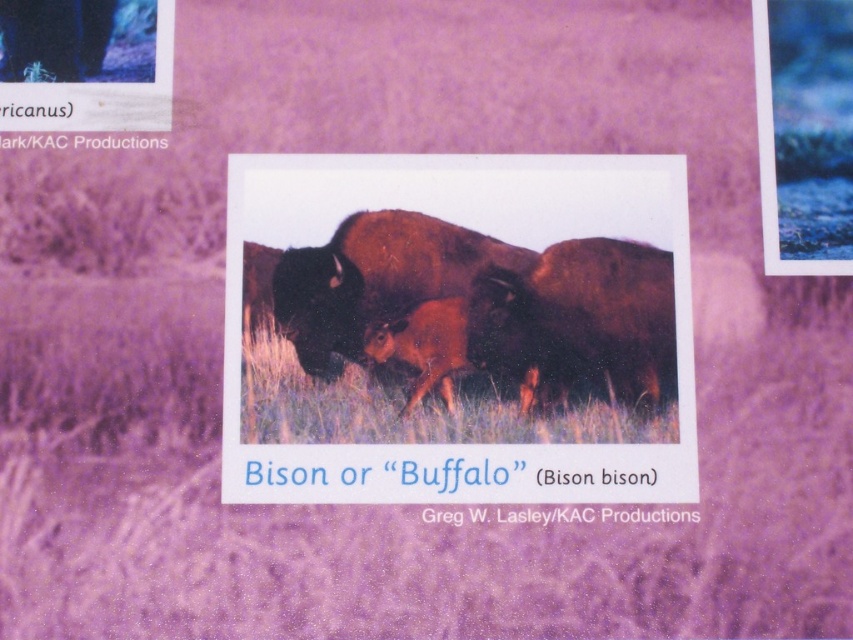
You are standing in front of a photograph of bison. There are two points marked on the photo, one at coordinates point (498,451) and another at point (349,273). If you were to draw a straight line from your current position to each point, which point would require the line to pass closer to the adult bison?

Point (498,451) is in front of point (349,273). Since the adult bison is likely positioned towards the front of the image, the line to point (498,451) would pass closer to the adult bison.

You are a museum curator planning to display a new exhibit about bison. The photograph in the scene is part of the exhibit. You need to ensure that the two bison in the photograph are clearly visible to visitors. Given that the minimum viewing distance for the exhibit is 10 feet, will the 2.84 inches distance between the brown fur bison at center and brown fuzzy bison at center be sufficient for visitors to distinguish them at that distance?

The distance between the brown fur bison at center and brown fuzzy bison at center is 2.84 inches. At a viewing distance of 10 feet, this separation should be sufficient for visitors to distinguish the two bison, as the spacing meets typical visual acuity requirements for such exhibits.

You are an animal caretaker who needs to identify which bison requires more space. Based on the image, which bison, the brown fur bison at center or the brown fuzzy bison at center, is bigger and thus needs more space?

The brown fur bison at center is larger in size than the brown fuzzy bison at center, so it needs more space.